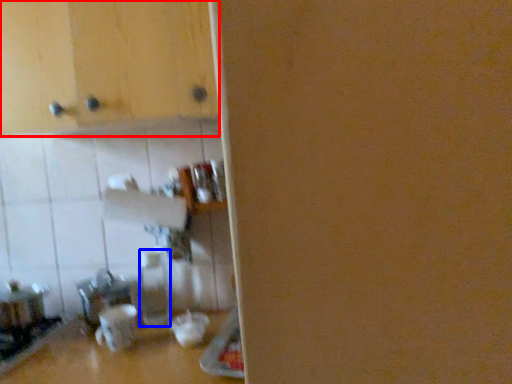
Question: Which object is further to the camera taking this photo, cabinetry (highlighted by a red box) or bottle (highlighted by a blue box)?

Choices:
 (A) cabinetry
 (B) bottle

Answer: (B)